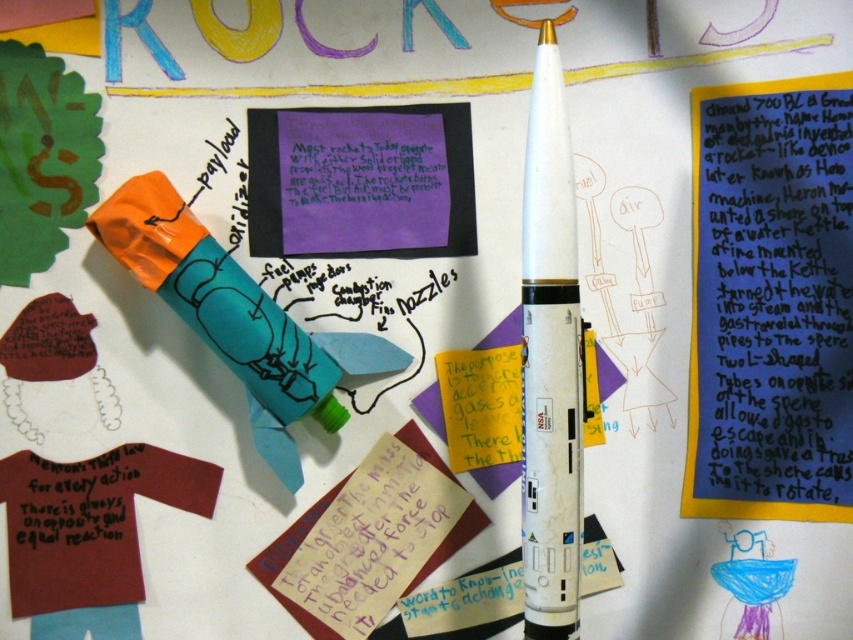
You are a student who needs to attach a label to the white matte rocket at center. The label you have is exactly 20 centimeters long. If you want to place the label so that one end touches the matte purple paper at upper right and the other end touches the rocket, will the label be long enough?

The distance between the matte purple paper at upper right and the white matte rocket at center is 19.86 centimeters. Since the label is exactly 20 centimeters long, it will be long enough to span the distance between them.

You are a student in the classroom looking at the educational display. You see a model rocket in the center and a point marked at coordinates (770, 301). What color is the object located at that point?

The object at point (770, 301) is matte purple paper at upper right.

You are standing in front of the educational display about rockets. You notice two points marked on the whiteboard at coordinates point (759, 148) and point (558, 58). Which point is closer to you?

Point (558, 58) is closer to you because point (759, 148) is behind it.